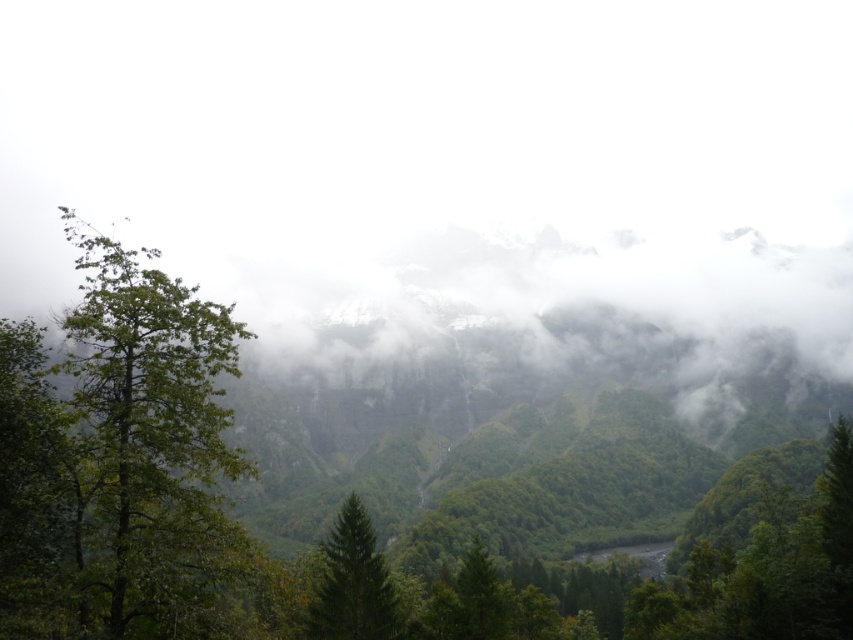
Consider the image. You are an environmental scientist studying the spatial distribution of vegetation in this mountainous area. You observe the green leafy tree at left and the green matte tree at center. Which of these two trees is positioned further to the east?

The green leafy tree at left is positioned to the left of the green matte tree at center. Since the image is viewed from a standard perspective where left corresponds to east, the green leafy tree at left is further to the east.

You are a hiker who wants to take a photo of the green leafy tree at left and the green matte tree at center. Which tree should you move closer to in order to capture both trees in the same frame without zooming in?

You should move closer to the green leafy tree at left because it is in front of the green matte tree at center, so moving closer to it will help include both trees in the frame without zooming in.